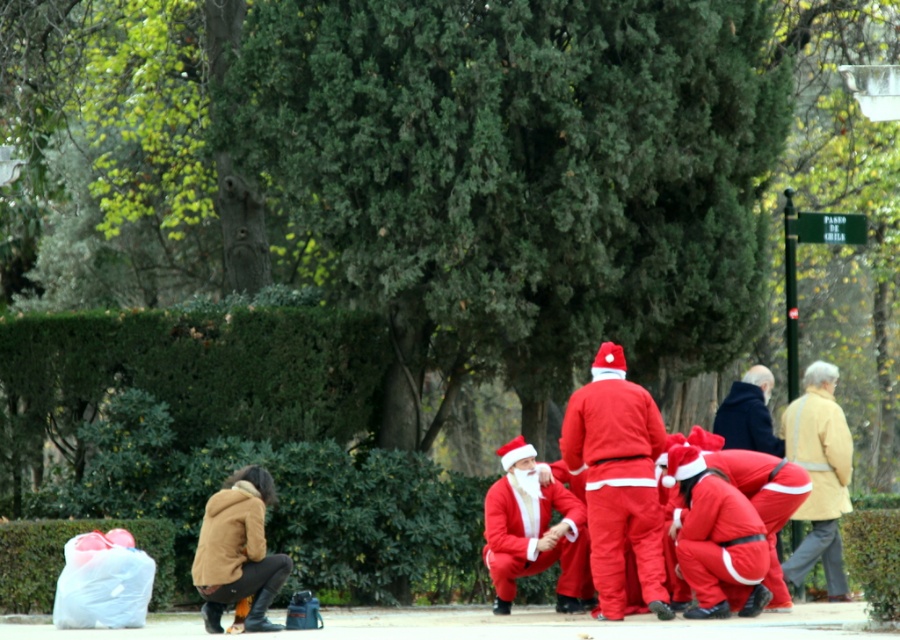
Question: Among these objects, which one is nearest to the camera?

Choices:
 (A) pavement at lower center
 (B) matte red santa at center
 (C) matte beige coat at right

Answer: (A)

Question: Does pavement at lower center appear under velvet red santa suit at lower right?

Choices:
 (A) no
 (B) yes

Answer: (B)

Question: Which point is farther to the camera?

Choices:
 (A) pavement at lower center
 (B) matte red santa suit at center
 (C) velvet red santa suit at lower right
 (D) matte beige coat at right

Answer: (C)

Question: Which object is the farthest from the matte red santa suit at center?

Choices:
 (A) pavement at lower center
 (B) matte beige coat at right
 (C) velvet red santa suit at lower right

Answer: (C)

Question: Can you confirm if pavement at lower center is bigger than matte red santa suit at center?

Choices:
 (A) no
 (B) yes

Answer: (A)

Question: Observing the image, what is the correct spatial positioning of matte red santa suit at center in reference to matte red santa at center?

Choices:
 (A) right
 (B) left

Answer: (A)